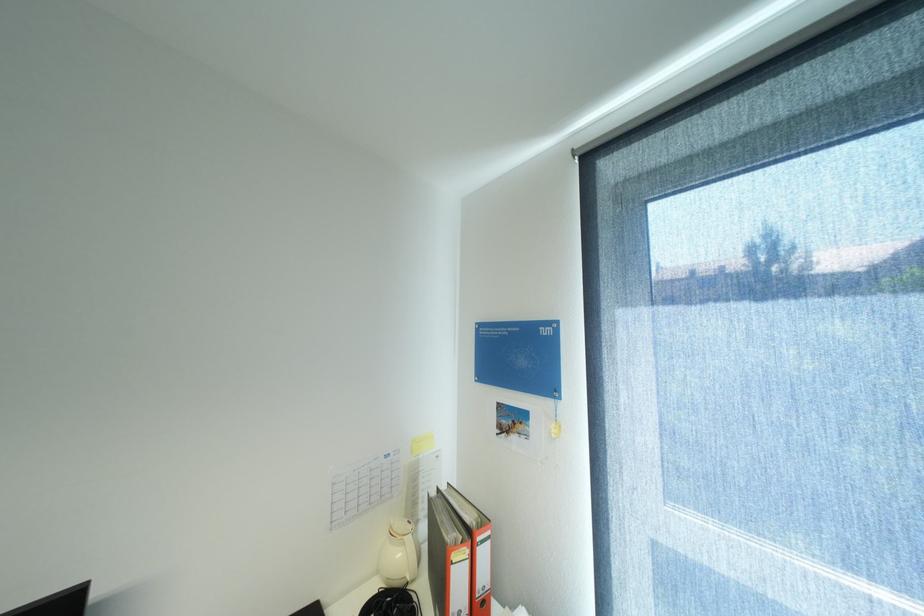
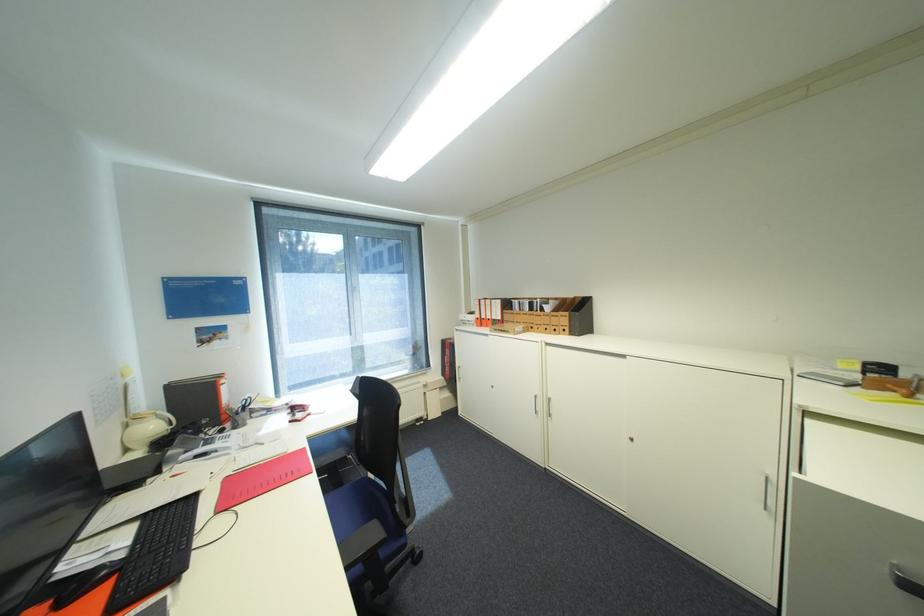
Find the pixel in the second image that matches point 407,554 in the first image.

(161, 427)